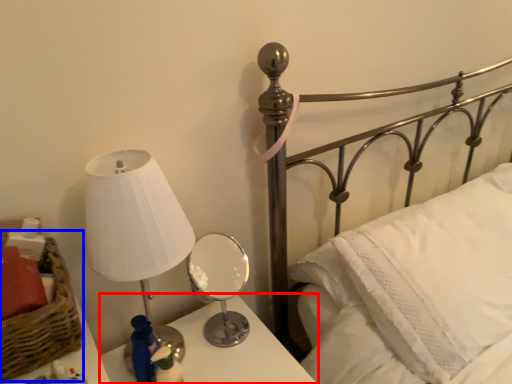
Question: Which object appears closest to the camera in this image, nightstand (highlighted by a red box) or basket (highlighted by a blue box)?

Choices:
 (A) nightstand
 (B) basket

Answer: (B)